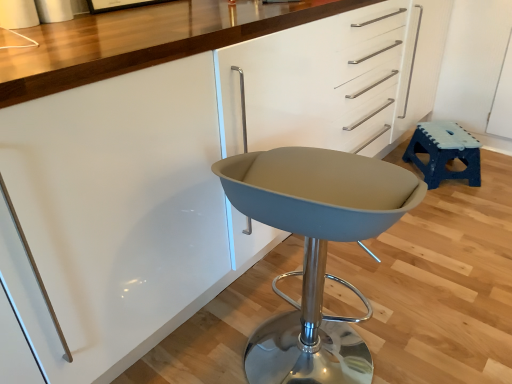
The image size is (512, 384). In order to click on free spot above blue plastic stool at right (from a real-world perspective) in this screenshot , I will do `click(443, 137)`.